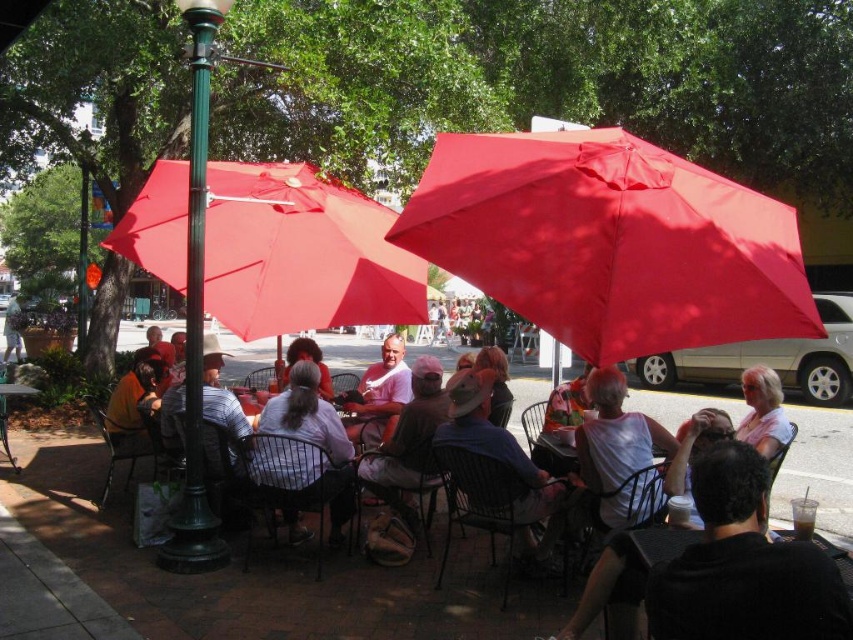
Question: Which point is closer to the camera taking this photo?

Choices:
 (A) (547, 540)
 (B) (0, 390)

Answer: (A)

Question: Can you confirm if matte red umbrella at center is thinner than metallic silver table at lower left?

Choices:
 (A) yes
 (B) no

Answer: (B)

Question: Can you confirm if matte pink shirt at center is thinner than metallic silver table at lower left?

Choices:
 (A) yes
 (B) no

Answer: (B)

Question: Considering the relative positions of matte red umbrella at center and brown leather jacket at lower left in the image provided, where is matte red umbrella at center located with respect to brown leather jacket at lower left?

Choices:
 (A) left
 (B) right

Answer: (B)

Question: Which point is closer to the camera?

Choices:
 (A) red fabric umbrella at center
 (B) black fabric shirt at lower right
 (C) white matte shirt at center
 (D) matte white shirt at center

Answer: (B)

Question: Which of the following is the farthest from the observer?

Choices:
 (A) (306, 358)
 (B) (775, 637)

Answer: (A)